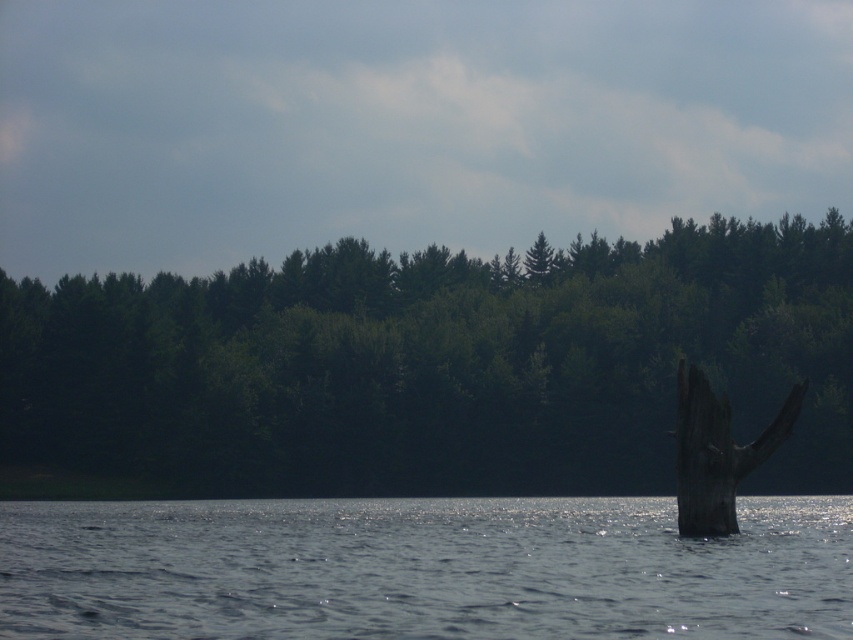
You are standing at the edge of the water and want to cross to the other side. The green matte forest at center and the clear blue water at center are in your path. Which one is wider, making it harder to navigate around?

The green matte forest at center is wider than the clear blue water at center, so it would be harder to navigate around.

You are standing on the bank of the lake and see the clear blue water at center and the dark brown wood at right. Which object is closer to the left side of the image?

The clear blue water at center is to the left of the dark brown wood at right, so the clear blue water at center is closer to the left side of the image.

You are a hiker standing at the edge of the water in the scene. You need to reach the green matte forest at center. Which direction should you walk from your current position?

The green matte forest at center is located at point coordinates, so you should walk towards the center of the scene to reach it.